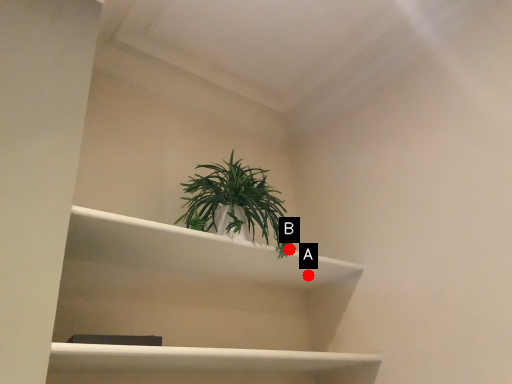
Question: Two points are circled on the image, labeled by A and B beside each circle. Which point appears closest to the camera in this image?

Choices:
 (A) A is closer
 (B) B is closer

Answer: (B)